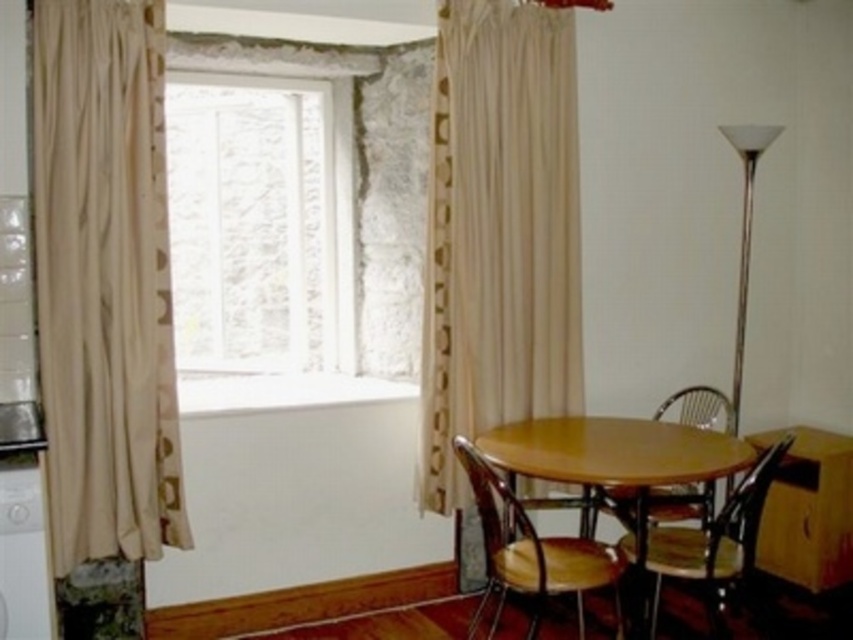
You are a decorator planning to hang a large painting that is 1.5 meters tall on the wall where the beige fabric curtain at left and wooden polished chair at lower right are located. Based on their heights, will the painting fit vertically between them?

The beige fabric curtain at left has a greater height compared to wooden polished chair at lower right. Since the painting is 1.5 meters tall, and the curtain is taller than the chair, the painting may fit vertically between them if the space between their heights is sufficient. However, without exact measurements of the vertical gap, it is uncertain. The answer should strictly use the given info, so since the curtain is taller, the painting could potentially fit if placed where the curtain is taller, but I

Based on the photo, you are a delivery person trying to place a large package that measures 6 feet in length between the beige fabric curtain at left and the wooden polished chair at lower right. Can you fit the package in this space without moving either object?

The distance between the beige fabric curtain at left and the wooden polished chair at lower right is 6.78 feet. Since the package is 6 feet long, it can fit in the space as there is enough room left after placing it.

You are standing in the dining area and want to reach a point that is 3.40 meters away from you. Is the point at coordinates point (482,609) within your reach?

The point (482,609) is exactly 3.40 meters away from you, so yes, you can reach it.